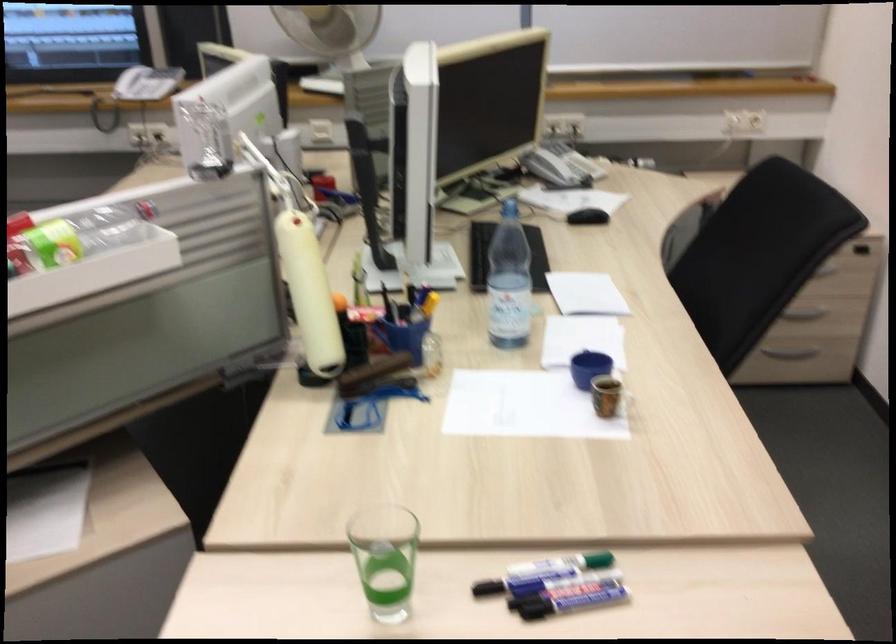
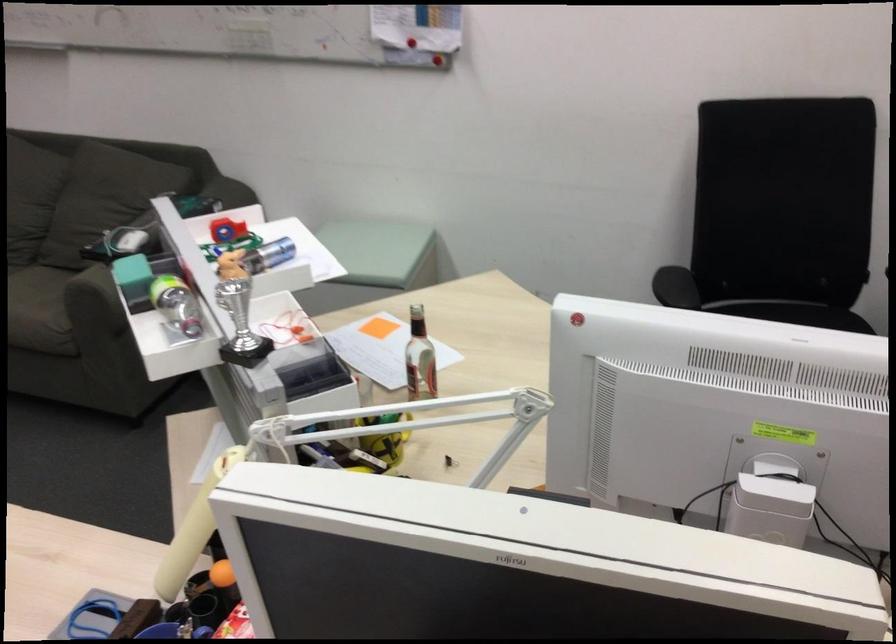
Find the pixel in the second image that matches point (176, 305) in the first image.

(367, 460)